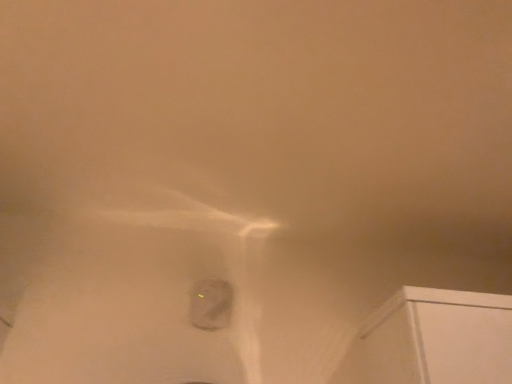
Find the location of a particular element. The image size is (512, 384). matte gray stone at center is located at coordinates (211, 304).

Image resolution: width=512 pixels, height=384 pixels. Describe the element at coordinates (211, 304) in the screenshot. I see `matte gray stone at center` at that location.

The width and height of the screenshot is (512, 384). Find the location of `matte gray stone at center`. matte gray stone at center is located at coordinates (211, 304).